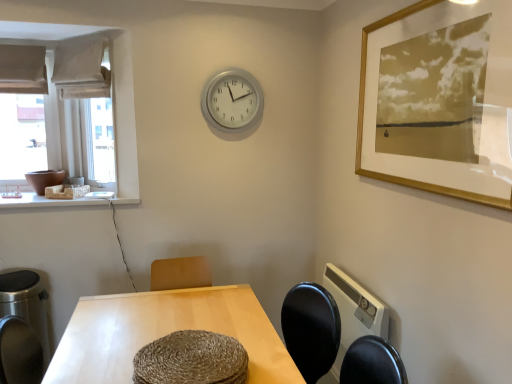
Question: From a real-world perspective, is white stone at left physically located above or below white fabric curtain at upper left?

Choices:
 (A) below
 (B) above

Answer: (A)

Question: From the image's perspective, is white stone at left positioned above or below white fabric curtain at upper left?

Choices:
 (A) below
 (B) above

Answer: (A)

Question: Which is nearer to the white stone at left?

Choices:
 (A) gold framed print at upper right
 (B) silver metallic clock at upper center
 (C) light wood table at center
 (D) white fabric curtain at upper left

Answer: (D)

Question: Based on their relative distances, which object is farther from the white stone at left?

Choices:
 (A) gold framed print at upper right
 (B) light wood table at center
 (C) white fabric curtain at upper left
 (D) silver metallic clock at upper center

Answer: (A)